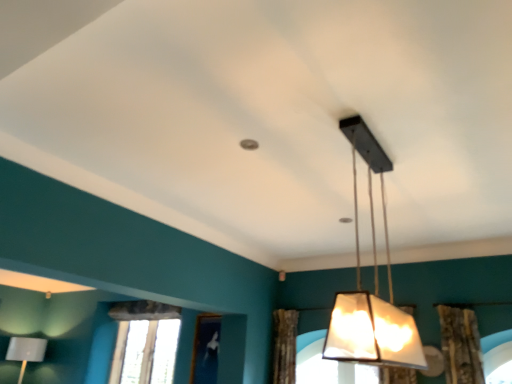
Question: From the image's perspective, is matte gray lampshade at lower left, arranged as the first lamp when ordered from the bottom, positioned above or below brown textured curtain at center?

Choices:
 (A) below
 (B) above

Answer: (A)

Question: Is matte gray lampshade at lower left, which is the 1th lamp from back to front, wider or thinner than brown textured curtain at center?

Choices:
 (A) wide
 (B) thin

Answer: (A)

Question: Considering the real-world distances, which object is closest to the brown textured curtain at center?

Choices:
 (A) matte black lampshade at center, the 2th lamp in the back-to-front sequence
 (B) matte gray lampshade at lower left, which ranks as the 1th lamp in left-to-right order
 (C) clear glass window at lower left

Answer: (C)

Question: Based on their relative distances, which object is nearer to the matte black lampshade at center, the 1th lamp viewed from the front?

Choices:
 (A) clear glass window at lower left
 (B) brown textured curtain at center
 (C) matte gray lampshade at lower left, which ranks as the 1th lamp in left-to-right order

Answer: (B)